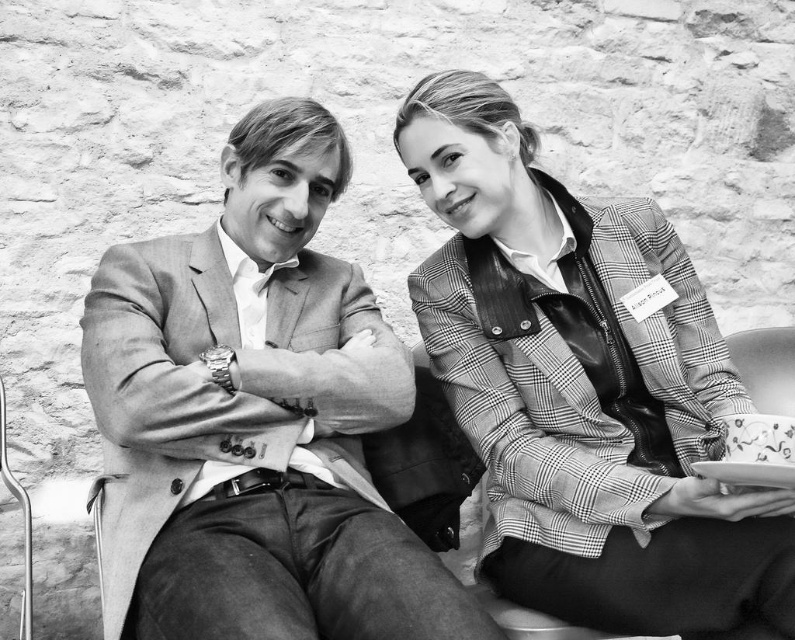
You are a photographer adjusting your camera settings to focus on the light brown leather jacket at center and the checkered fabric blazer at center. Which object should you focus on first to ensure proper depth of field?

The light brown leather jacket at center is closer to the viewer than the checkered fabric blazer at center, so you should focus on the light brown leather jacket at center first to ensure proper depth of field.